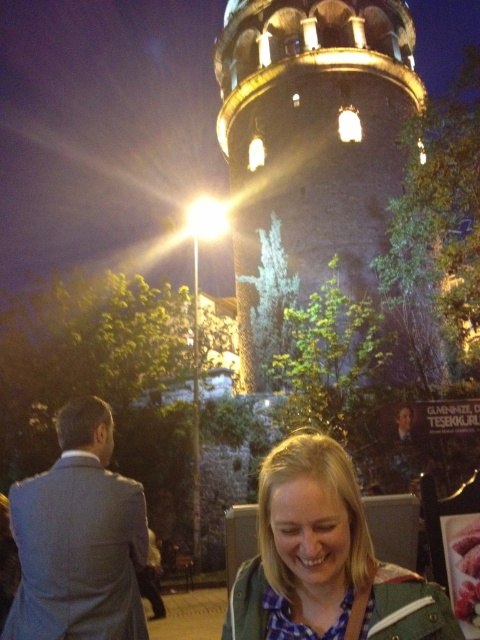
Who is shorter, blonde hair at lower center or gray wool suit at left?

Standing shorter between the two is blonde hair at lower center.

Who is positioned more to the right, blonde hair at lower center or gray wool suit at left?

blonde hair at lower center

Is point (317, 451) behind point (109, 545)?

No, it is in front of (109, 545).

This screenshot has width=480, height=640. What are the coordinates of `blonde hair at lower center` in the screenshot? It's located at (324, 561).

Can you confirm if stone tower at center is taller than blonde hair at lower center?

Yes.

Based on the photo, can you confirm if stone tower at center is positioned to the right of blonde hair at lower center?

Indeed, stone tower at center is positioned on the right side of blonde hair at lower center.

The height and width of the screenshot is (640, 480). What do you see at coordinates (314, 129) in the screenshot?
I see `stone tower at center` at bounding box center [314, 129].

Locate an element on the screen. Image resolution: width=480 pixels, height=640 pixels. stone tower at center is located at coordinates (314, 129).

From the picture: Can you confirm if stone tower at center is taller than gray wool suit at left?

Correct, stone tower at center is much taller as gray wool suit at left.

Is stone tower at center smaller than gray wool suit at left?

No, stone tower at center is not smaller than gray wool suit at left.

Find the location of a particular element. The image size is (480, 640). stone tower at center is located at coordinates (314, 129).